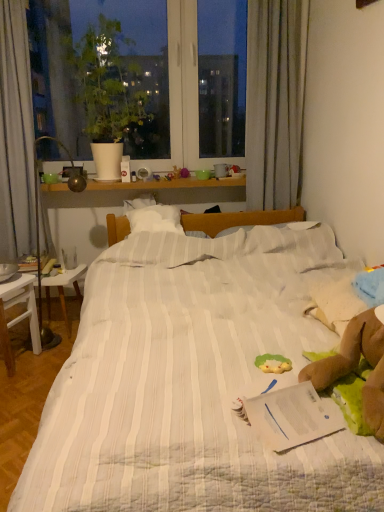
Question: From a real-world perspective, does green plush toy at center stand above green matte plant at upper left?

Choices:
 (A) yes
 (B) no

Answer: (B)

Question: Does green plush toy at center have a lesser width compared to green matte plant at upper left?

Choices:
 (A) no
 (B) yes

Answer: (B)

Question: Can you confirm if green plush toy at center is taller than green matte plant at upper left?

Choices:
 (A) yes
 (B) no

Answer: (B)

Question: Are green plush toy at center and green matte plant at upper left far apart?

Choices:
 (A) yes
 (B) no

Answer: (A)

Question: Is green plush toy at center positioned in front of green matte plant at upper left?

Choices:
 (A) yes
 (B) no

Answer: (A)

Question: From a real-world perspective, is green plush toy at center beneath green matte plant at upper left?

Choices:
 (A) no
 (B) yes

Answer: (B)

Question: Does white wooden table at left, the first table in the back-to-front sequence, turn towards white paper at center?

Choices:
 (A) yes
 (B) no

Answer: (B)

Question: Does white wooden table at left, placed as the second table when sorted from front to back, appear on the right side of white paper at center?

Choices:
 (A) no
 (B) yes

Answer: (A)

Question: From a real-world perspective, does white wooden table at left, placed as the second table when sorted from front to back, sit lower than white paper at center?

Choices:
 (A) no
 (B) yes

Answer: (B)

Question: Would you say white paper at center is part of white wooden table at left, placed as the second table when sorted from front to back,'s contents?

Choices:
 (A) no
 (B) yes

Answer: (A)

Question: From the image's perspective, would you say white wooden table at left, the first table in the back-to-front sequence, is shown under white paper at center?

Choices:
 (A) no
 (B) yes

Answer: (A)

Question: Is white wooden table at left, placed as the second table when sorted from front to back, looking in the opposite direction of white paper at center?

Choices:
 (A) yes
 (B) no

Answer: (B)

Question: Can you confirm if green plush toy at center is taller than white paper at center?

Choices:
 (A) yes
 (B) no

Answer: (B)